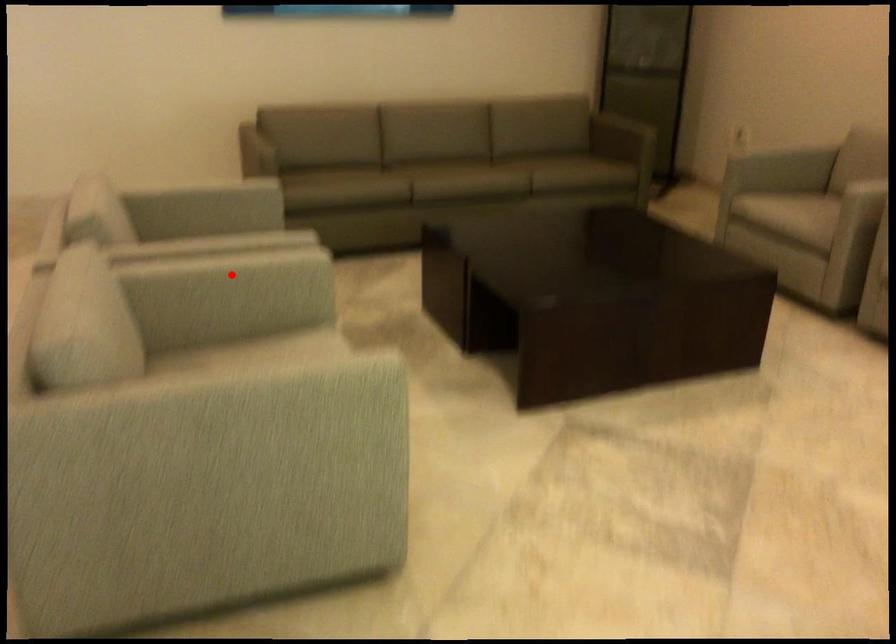
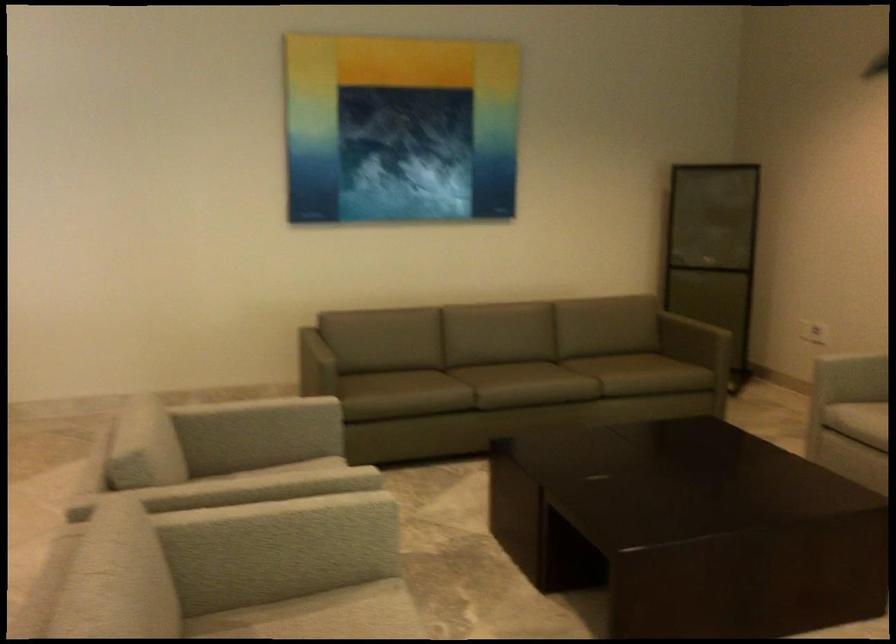
Question: I am providing you with two images of the same scene from different viewpoints. Given a red point in image1, look at the same physical point in image2. Is it:

Choices:
 (A) Closer to the viewpoint
 (B) Farther from the viewpoint

Answer: (A)